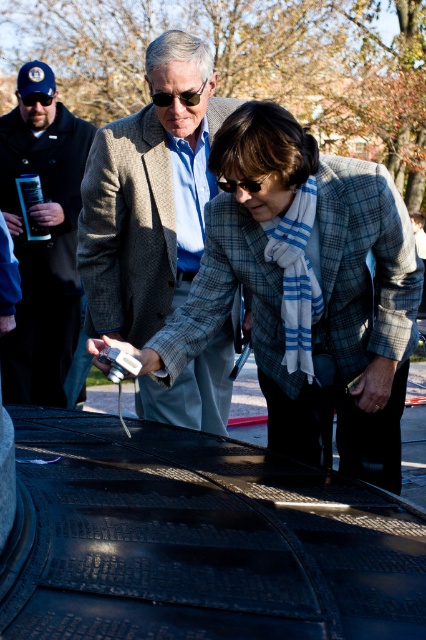
You are a photographer at the event and need to position yourself so that your camera is exactly at point (319, 288). What object will be directly in front of your camera lens?

The plaid wool jacket at center will be directly in front of your camera lens at point (319, 288).

You are a fashion designer observing the two coats in the image. The brown woolen coat at center and the dark blue wool jacket at left. Which one has a wider silhouette?

The brown woolen coat at center might be wider than dark blue wool jacket at left.

You are a photographer at a formal event. You see two people wearing the plaid wool jacket at center and the brown woolen coat at center. Which one is more to the right?

The plaid wool jacket at center is more to the right side of the brown woolen coat at center.